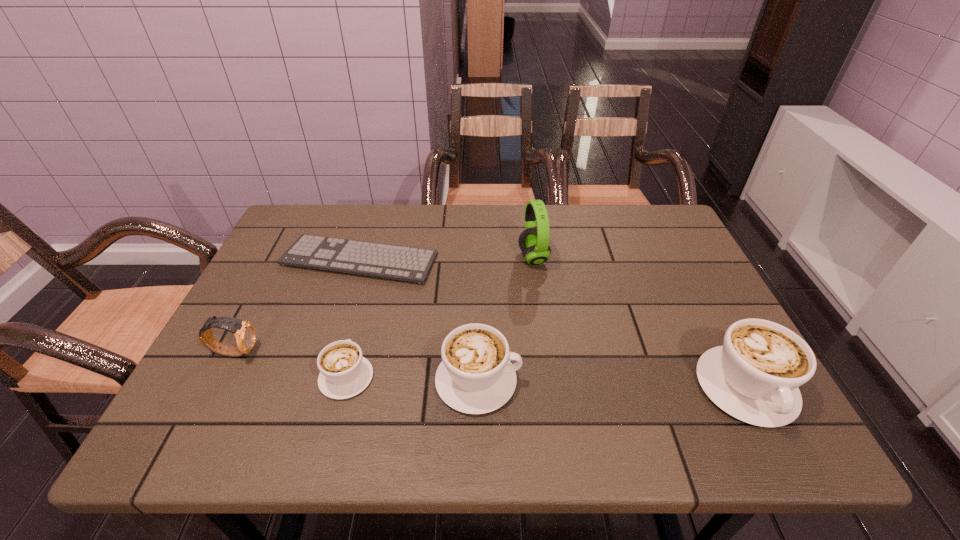
Where is `cappuccino that is the second closest to the fourth object from left to right`? The height and width of the screenshot is (540, 960). cappuccino that is the second closest to the fourth object from left to right is located at coordinates (754, 377).

Identify the location of vacant region that satisfies the following two spatial constraints: 1. to the right of the fifth tallest object's handle; 2. on the face of the watch. Image resolution: width=960 pixels, height=540 pixels. (353, 352).